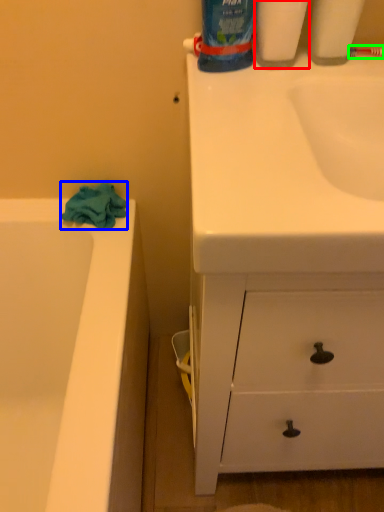
Question: Which object is the closest to the cleaning product (highlighted by a red box)? Choose among these: bath towel (highlighted by a blue box) or toothbrush (highlighted by a green box).

Choices:
 (A) bath towel
 (B) toothbrush

Answer: (B)